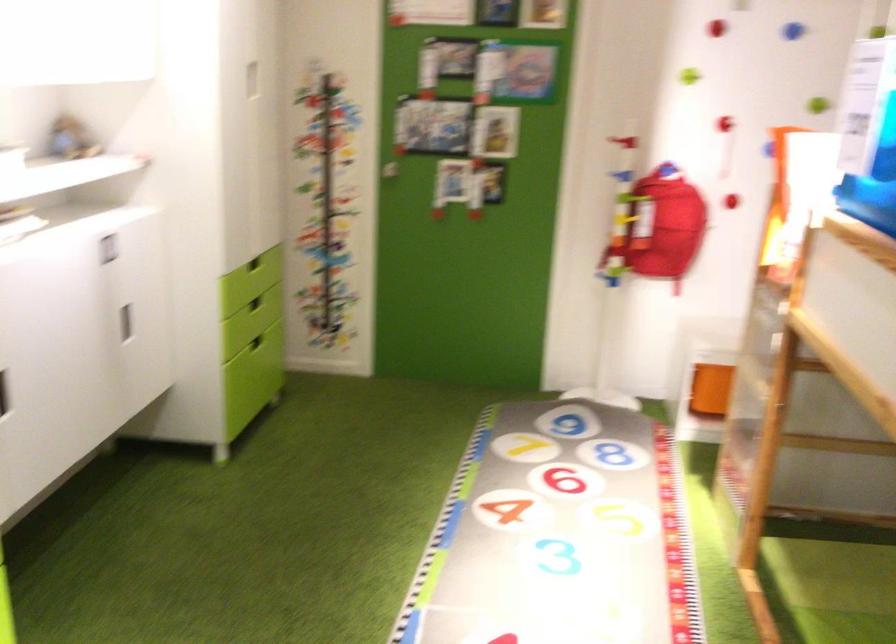
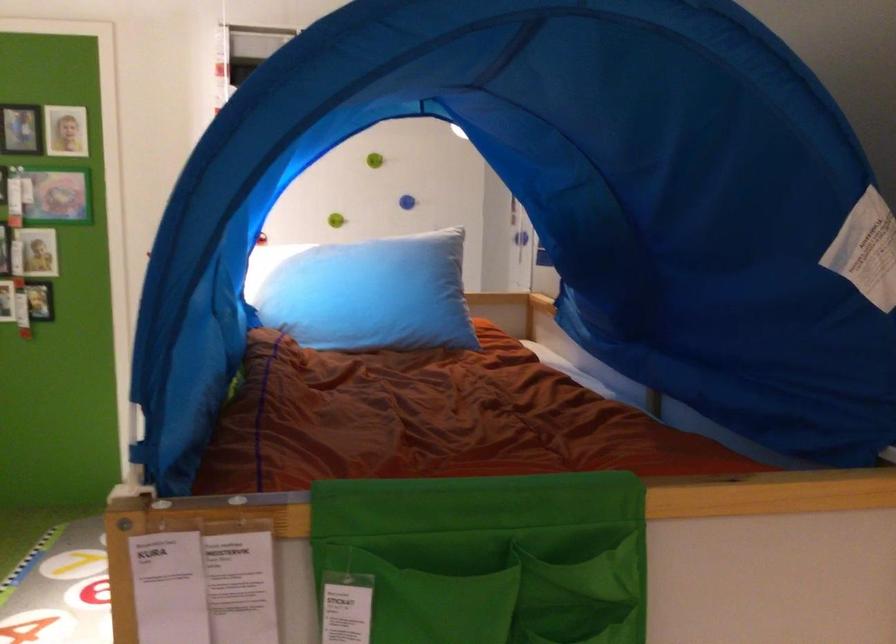
Question: I am providing you with two images of the same scene from different viewpoints. After the viewpoint changes to image2, which objects are now occluded?

Choices:
 (A) red climbing hold
 (B) green wall knob
 (C) light blue pillow
 (D) yellow paper folder

Answer: (A)